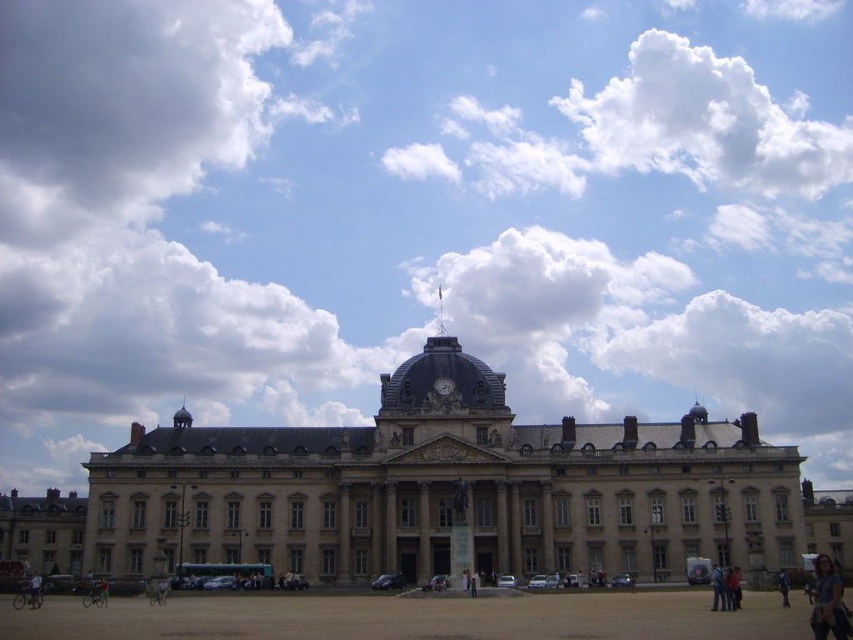
Question: Which object appears closest to the camera in this image?

Choices:
 (A) green fabric bicycle at lower left
 (B) white fluffy cloud at upper center
 (C) blue denim jeans at lower right

Answer: (C)

Question: Is blue fabric person at lower right thinner than matte gray clock at center?

Choices:
 (A) no
 (B) yes

Answer: (A)

Question: Which object is farther from the camera taking this photo?

Choices:
 (A) matte gray clock at center
 (B) light blue denim jeans at lower left

Answer: (A)

Question: Which of the following is the closest to the observer?

Choices:
 (A) (451, 384)
 (B) (782, 602)
 (C) (33, 572)
 (D) (106, 582)

Answer: (B)

Question: From the image, what is the correct spatial relationship of blue denim jeans at lower right in relation to light blue denim jeans at lower left?

Choices:
 (A) below
 (B) above

Answer: (B)

Question: Can you confirm if beige stone building at center is thinner than blue fabric person at lower right?

Choices:
 (A) yes
 (B) no

Answer: (B)